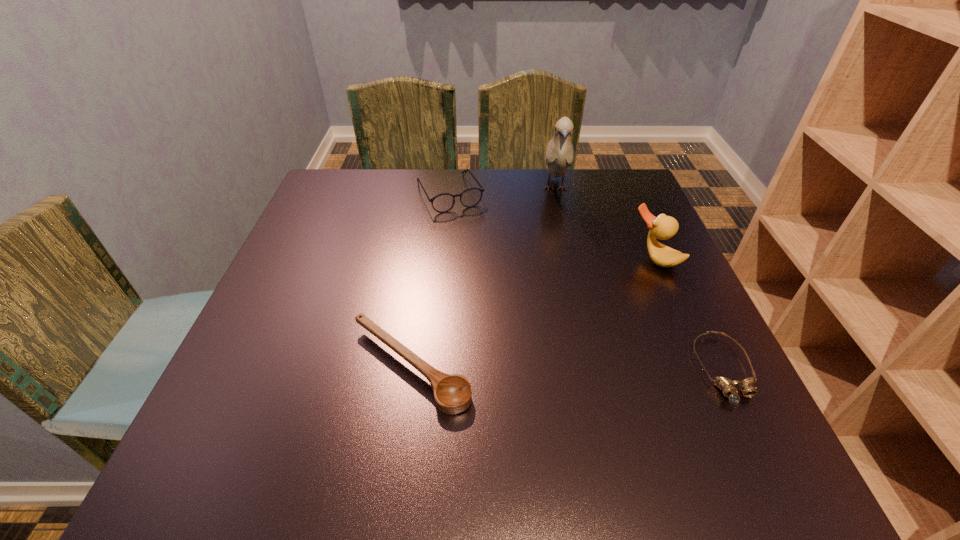
Find the location of a particular element. goggles at the near edge is located at coordinates (728, 387).

What are the coordinates of `goggles that is at the right edge` in the screenshot? It's located at (728, 387).

Locate an element on the screen. duck that is at the right edge is located at coordinates (663, 227).

The image size is (960, 540). What are the coordinates of `object at the near right corner` in the screenshot? It's located at (728, 387).

In the image, there is a desktop. Where is `vacant space at the far edge`? vacant space at the far edge is located at coordinates (480, 169).

Where is `free location at the near edge of the desktop`? This screenshot has width=960, height=540. free location at the near edge of the desktop is located at coordinates (311, 420).

The height and width of the screenshot is (540, 960). In the image, there is a desktop. Find the location of `blank space at the left edge`. blank space at the left edge is located at coordinates pos(303,268).

Locate an element on the screen. The image size is (960, 540). vacant space at the far left corner of the desktop is located at coordinates (327, 215).

Locate an element on the screen. The width and height of the screenshot is (960, 540). free space at the far right corner of the desktop is located at coordinates (598, 174).

Find the location of a particular element. free spot between the third shortest object and the third farthest object is located at coordinates (551, 226).